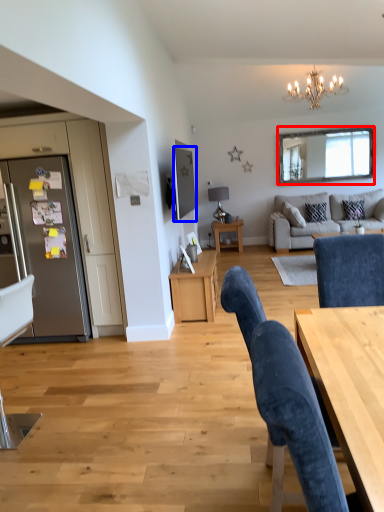
Question: Which object is further to the camera taking this photo, mirror (highlighted by a red box) or television (highlighted by a blue box)?

Choices:
 (A) mirror
 (B) television

Answer: (A)